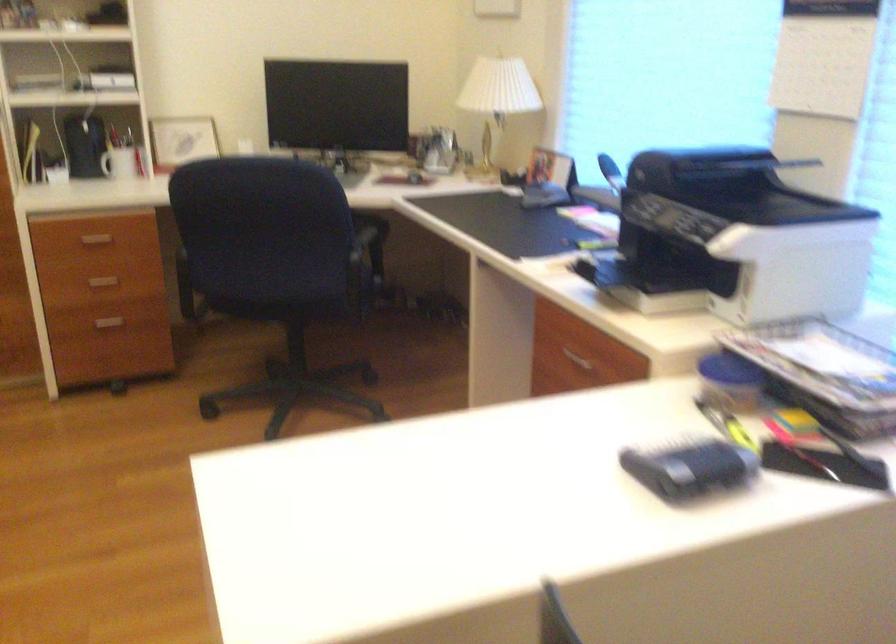
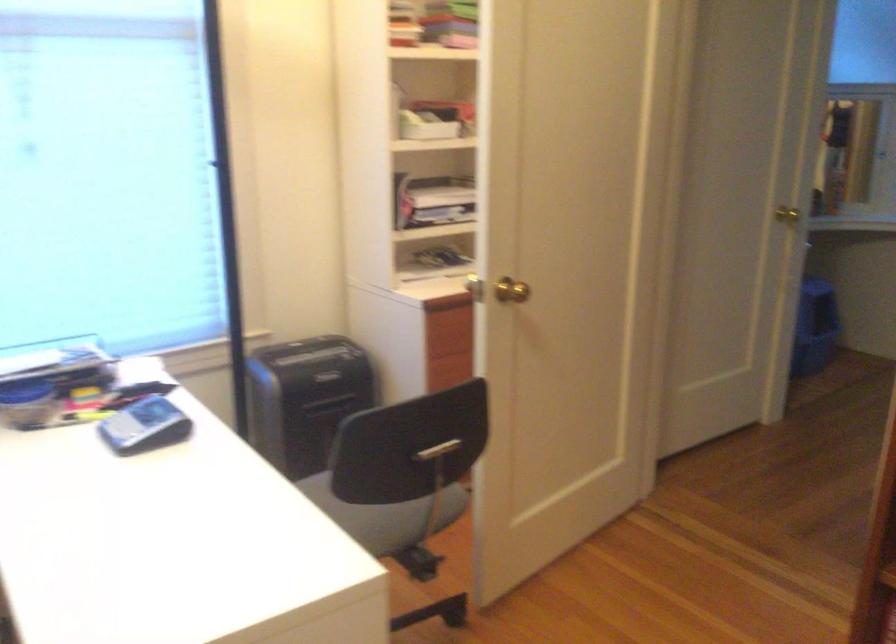
The point at (686, 459) is marked in the first image. Where is the corresponding point in the second image?

(143, 426)